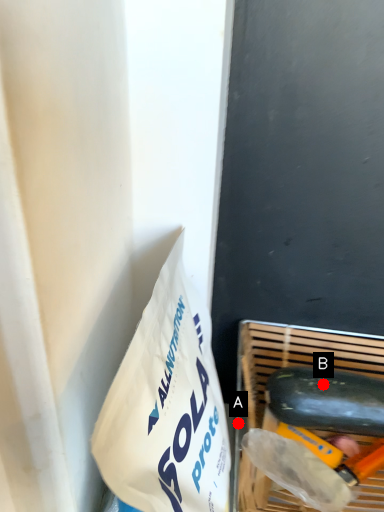
Question: Two points are circled on the image, labeled by A and B beside each circle. Which point is closer to the camera?

Choices:
 (A) A is closer
 (B) B is closer

Answer: (B)